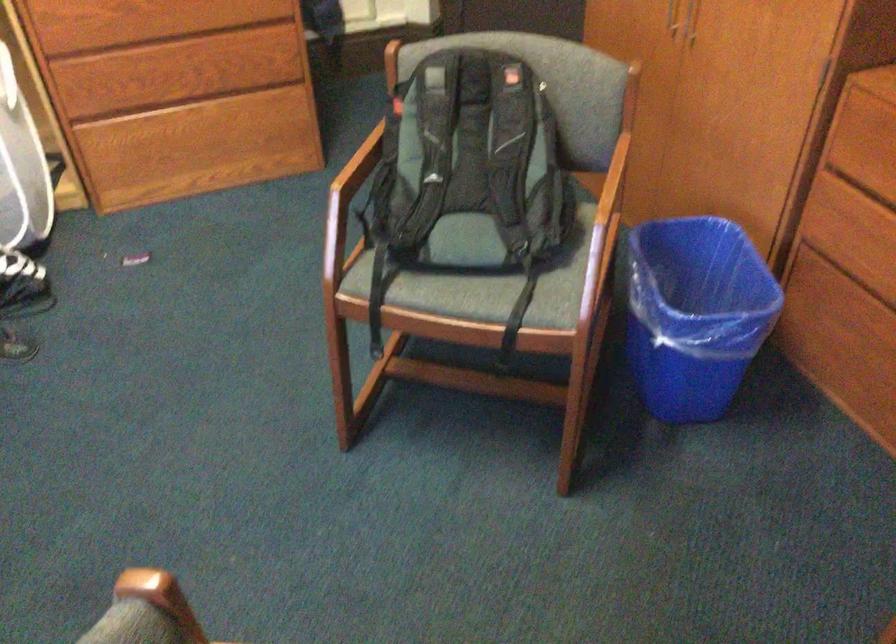
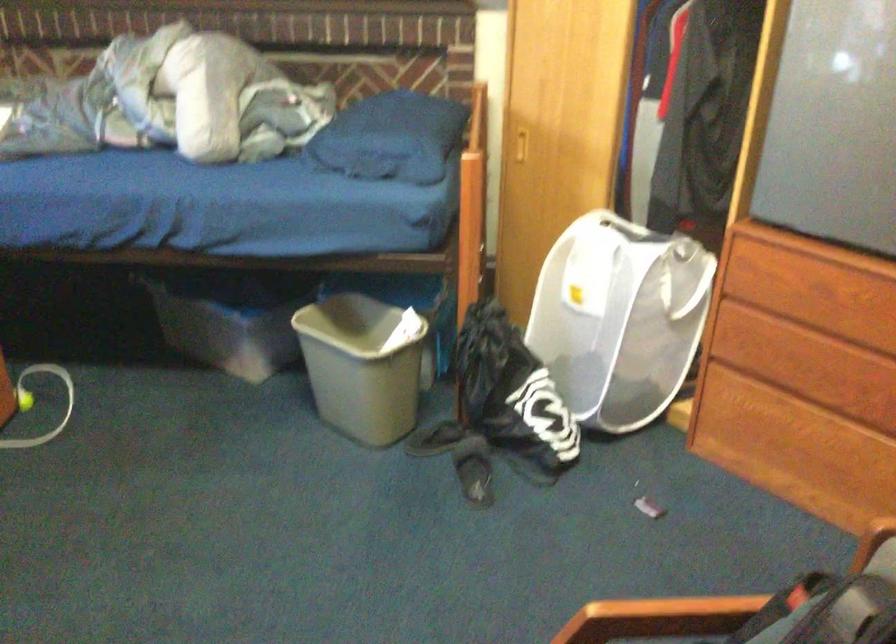
Question: How did the camera likely rotate?

Choices:
 (A) Left
 (B) Right
 (C) Up
 (D) Down

Answer: (A)